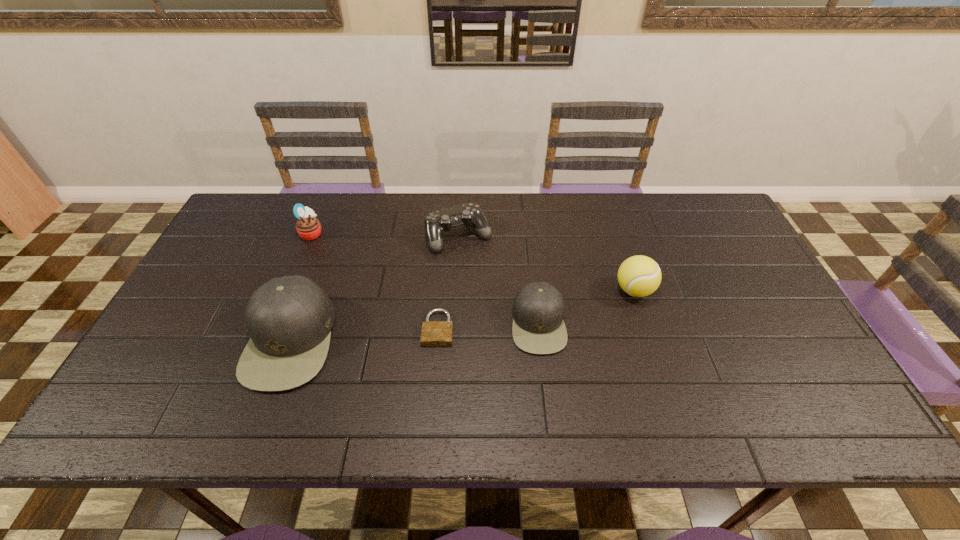
Where is `the left cap`? Image resolution: width=960 pixels, height=540 pixels. the left cap is located at coordinates (289, 319).

Locate an element on the screen. the taller cap is located at coordinates (289, 319).

The width and height of the screenshot is (960, 540). Identify the location of the shorter cap. (538, 327).

This screenshot has width=960, height=540. What are the coordinates of `the second object from right to left` in the screenshot? It's located at (538, 327).

Where is `control`? The image size is (960, 540). control is located at coordinates (436, 223).

This screenshot has width=960, height=540. Identify the location of muffin. (308, 227).

The height and width of the screenshot is (540, 960). What are the coordinates of `the shortest object` in the screenshot? It's located at (433, 333).

Where is `tennis ball`? tennis ball is located at coordinates (639, 276).

The height and width of the screenshot is (540, 960). I want to click on vacant region located 0.120m on the brim of the tallest object, so click(x=201, y=340).

This screenshot has width=960, height=540. I want to click on blank area located 0.180m on the brim of the tallest object, so click(178, 340).